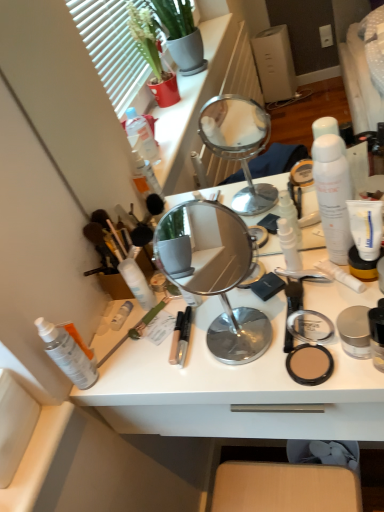
Question: Is transparent plastic spray bottle at lower left, the 1th toiletry from the left, thinner than white matte spray can at center, which is the fourth toiletry in left-to-right order?

Choices:
 (A) no
 (B) yes

Answer: (A)

Question: Is transparent plastic spray bottle at lower left, the 1th toiletry from the left, to the left of white matte spray can at center, which is the fourth toiletry in left-to-right order, from the viewer's perspective?

Choices:
 (A) yes
 (B) no

Answer: (A)

Question: Can you confirm if transparent plastic spray bottle at lower left, the 1th toiletry from the left, is taller than white matte spray can at center, which is the third toiletry in right-to-left order?

Choices:
 (A) no
 (B) yes

Answer: (B)

Question: Considering the relative positions of transparent plastic spray bottle at lower left, the 6th toiletry viewed from the right, and white matte spray can at center, which is the fourth toiletry in left-to-right order, in the image provided, is transparent plastic spray bottle at lower left, the 6th toiletry viewed from the right, to the right of white matte spray can at center, which is the fourth toiletry in left-to-right order, from the viewer's perspective?

Choices:
 (A) no
 (B) yes

Answer: (A)

Question: From the image's perspective, is transparent plastic spray bottle at lower left, the 6th toiletry viewed from the right, located beneath white matte spray can at center, which is the fourth toiletry in left-to-right order?

Choices:
 (A) yes
 (B) no

Answer: (A)

Question: Is white matte tube at right, the first toothpaste when ordered from bottom to top, wider or thinner than matte beige compact at right?

Choices:
 (A) thin
 (B) wide

Answer: (B)

Question: Would you say white matte tube at right, the second toothpaste viewed from the top, is to the left or to the right of matte beige compact at right in the picture?

Choices:
 (A) right
 (B) left

Answer: (A)

Question: From a real-world perspective, is white matte tube at right, the first toothpaste when ordered from bottom to top, positioned above or below matte beige compact at right?

Choices:
 (A) above
 (B) below

Answer: (A)

Question: Would you say white matte tube at right, the first toothpaste when ordered from bottom to top, is inside or outside matte beige compact at right?

Choices:
 (A) inside
 (B) outside

Answer: (B)

Question: In terms of height, does matte beige compact at right look taller or shorter compared to white matte tube at right, the first toothpaste when ordered from bottom to top?

Choices:
 (A) short
 (B) tall

Answer: (B)

Question: From a real-world perspective, is matte beige compact at right positioned above or below white matte tube at right, the second toothpaste viewed from the top?

Choices:
 (A) below
 (B) above

Answer: (A)

Question: Visually, is matte beige compact at right positioned to the left or to the right of white matte tube at right, the second toothpaste viewed from the top?

Choices:
 (A) left
 (B) right

Answer: (A)

Question: Considering the positions of matte beige compact at right and white matte tube at right, the second toothpaste viewed from the top, in the image, is matte beige compact at right bigger or smaller than white matte tube at right, the second toothpaste viewed from the top,?

Choices:
 (A) small
 (B) big

Answer: (B)

Question: Considering the positions of white matte tube at right, the second toothpaste ordered from the bottom, and white matte tube at right, the second toothpaste viewed from the top, in the image, is white matte tube at right, the second toothpaste ordered from the bottom, wider or thinner than white matte tube at right, the second toothpaste viewed from the top,?

Choices:
 (A) wide
 (B) thin

Answer: (B)

Question: Based on their positions, is white matte tube at right, acting as the first toothpaste starting from the top, located to the left or right of white matte tube at right, the second toothpaste viewed from the top?

Choices:
 (A) left
 (B) right

Answer: (B)